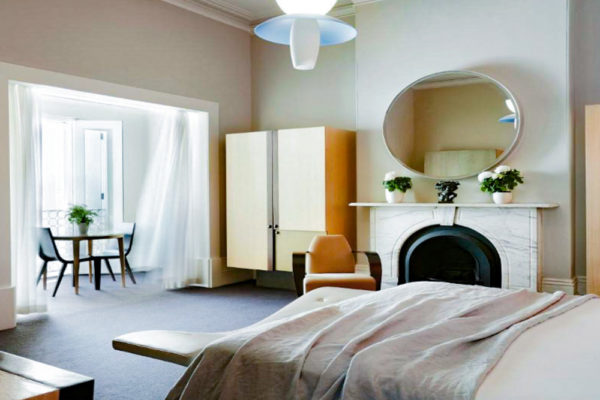
This screenshot has height=400, width=600. Identify the location of light. (305, 45).